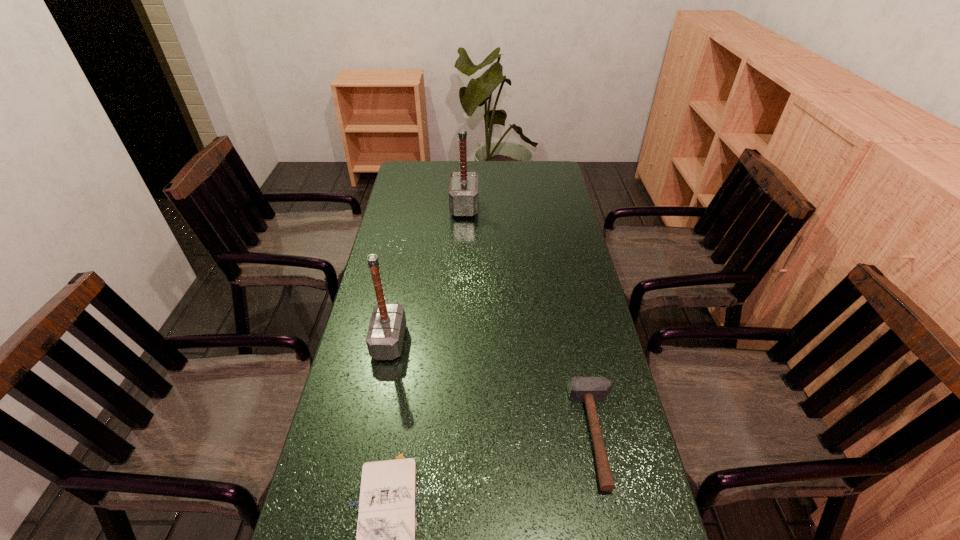
Locate an element on the screen. empty location between the leftmost hammer and the second hammer from right to left is located at coordinates (427, 274).

Identify the location of blank region between the rightmost object and the farthest object. This screenshot has width=960, height=540. (532, 321).

Find the location of a particular element. The width and height of the screenshot is (960, 540). unoccupied position between the second hammer from right to left and the leftmost hammer is located at coordinates (427, 274).

The height and width of the screenshot is (540, 960). What are the coordinates of `empty space that is in between the nearest hammer and the leftmost hammer` in the screenshot? It's located at (493, 388).

Locate which object ranks second in proximity to the shortest object. Please provide its 2D coordinates. Your answer should be formatted as a tuple, i.e. [(x, y)], where the tuple contains the x and y coordinates of a point satisfying the conditions above.

[(580, 389)]

The image size is (960, 540). Find the location of `the second closest object to the leftmost hammer`. the second closest object to the leftmost hammer is located at coordinates (580, 389).

You are a GUI agent. You are given a task and a screenshot of the screen. Output one action in this format:
    pyautogui.click(x=<x>, y=<y>)
    Task: Click on the hammer identified as the closest to the second object from right to left
    The image size is (960, 540).
    Given the screenshot: What is the action you would take?
    pyautogui.click(x=385, y=336)

Choose which hammer is the nearest neighbor to the notebook. Please provide its 2D coordinates. Your answer should be formatted as a tuple, i.e. [(x, y)], where the tuple contains the x and y coordinates of a point satisfying the conditions above.

[(385, 336)]